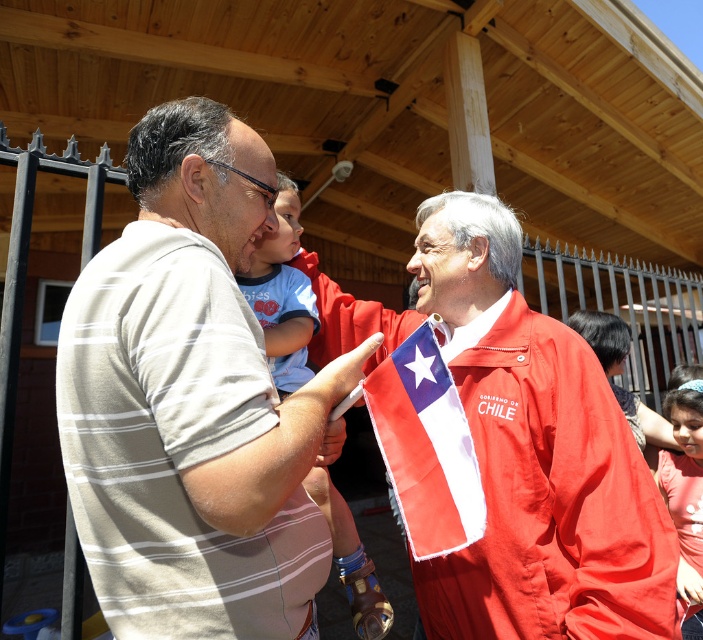
Looking at this image, you are a photographer standing in front of the wooden structure. You want to take a photo of both the red fabric flag at center and the light blue cotton shirt at upper center. Which object should you focus on first to ensure both are in focus?

You should focus on the red fabric flag at center first because it is closer to the viewer than the light blue cotton shirt at upper center. By focusing on the closer object, the farther one may still be in the depth of field, ensuring both are in focus.

You are a photographer at the event and want to capture both the striped cotton shirt at left and the light blue cotton shirt at upper center in a single frame. Which shirt should you focus on first to ensure both are in the frame?

The striped cotton shirt at left has a lesser height compared to light blue cotton shirt at upper center, so you should focus on the light blue cotton shirt at upper center first to ensure both are in the frame.